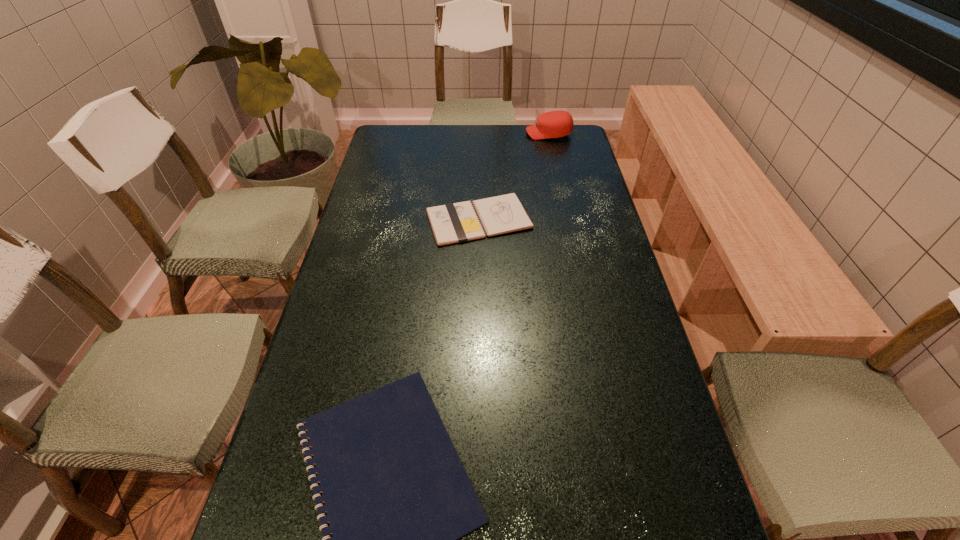
In order to click on the rightmost object in this screenshot , I will do `click(553, 124)`.

Image resolution: width=960 pixels, height=540 pixels. Identify the location of the farthest object. (553, 124).

Identify the location of the farther notepad. This screenshot has width=960, height=540. (451, 223).

Locate an element on the screen. the second tallest object is located at coordinates (451, 223).

This screenshot has width=960, height=540. Identify the location of free location located on the front-facing side of the cap. (468, 134).

Locate an element on the screen. vacant region located on the front-facing side of the cap is located at coordinates (475, 134).

The image size is (960, 540). Find the location of `vacant point located on the front-facing side of the cap`. vacant point located on the front-facing side of the cap is located at coordinates (480, 134).

You are a GUI agent. You are given a task and a screenshot of the screen. Output one action in this format:
    pyautogui.click(x=<x>, y=<y>)
    Task: Click on the free space located 0.130m on the right of the taller notepad
    
    Given the screenshot: What is the action you would take?
    pyautogui.click(x=574, y=220)

Find the location of a particular element. This screenshot has width=960, height=540. object that is at the far edge is located at coordinates (553, 124).

Where is `object positioned at the right edge`? The width and height of the screenshot is (960, 540). object positioned at the right edge is located at coordinates (553, 124).